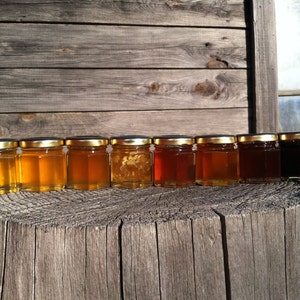
Image resolution: width=300 pixels, height=300 pixels. Identify the location of jars. (8, 165), (38, 173), (91, 163), (131, 163), (175, 157), (208, 160), (256, 154), (290, 153).